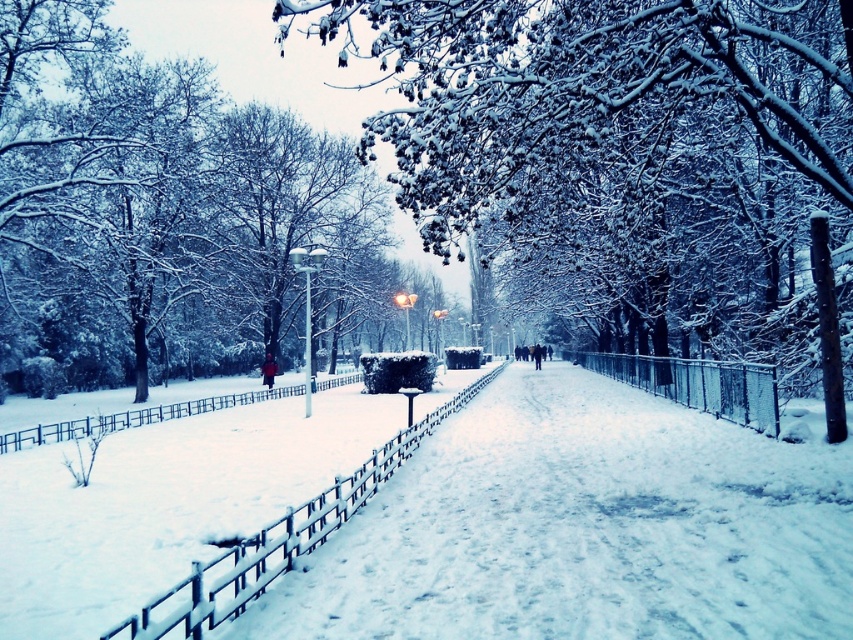
Question: Considering the real-world distances, which object is closest to the white wooden fence at center?

Choices:
 (A) white plastic fence at lower left
 (B) snow-covered tree at center
 (C) snow-covered branches at center
 (D) metallic silver fence at center-right

Answer: (C)

Question: Is white wooden fence at center positioned at the back of metallic silver fence at center-right?

Choices:
 (A) no
 (B) yes

Answer: (A)

Question: Estimate the real-world distances between objects in this image. Which object is farther from the snow-covered tree at center?

Choices:
 (A) white plastic fence at lower left
 (B) metallic silver fence at center-right
 (C) white wooden fence at center
 (D) snow-covered branches at center

Answer: (C)

Question: Which of the following is the farthest from the observer?

Choices:
 (A) white wooden fence at center
 (B) metallic silver fence at center-right
 (C) snow-covered tree at center

Answer: (C)

Question: Considering the relative positions of snow-covered branches at center and metallic silver fence at center-right in the image provided, where is snow-covered branches at center located with respect to metallic silver fence at center-right?

Choices:
 (A) above
 (B) below

Answer: (A)

Question: Is snow-covered branches at center thinner than white wooden fence at center?

Choices:
 (A) no
 (B) yes

Answer: (A)